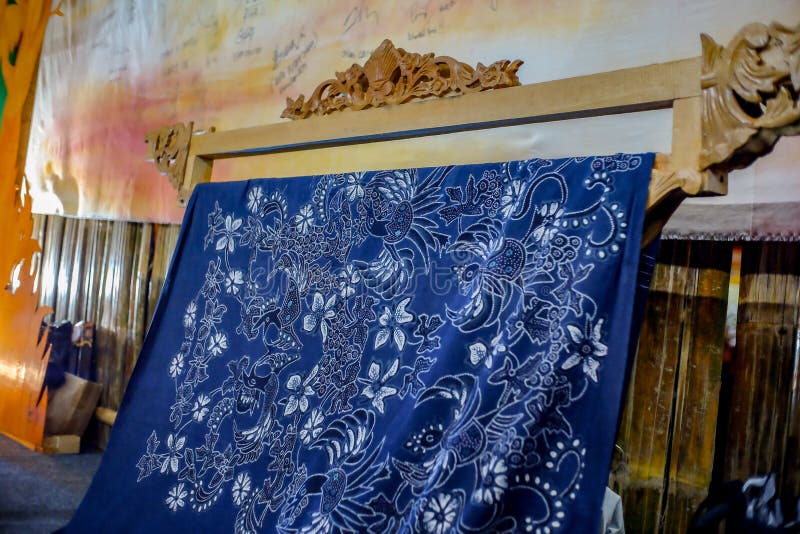
The height and width of the screenshot is (534, 800). What are the coordinates of `right side of shelf` in the screenshot? It's located at (728, 92).